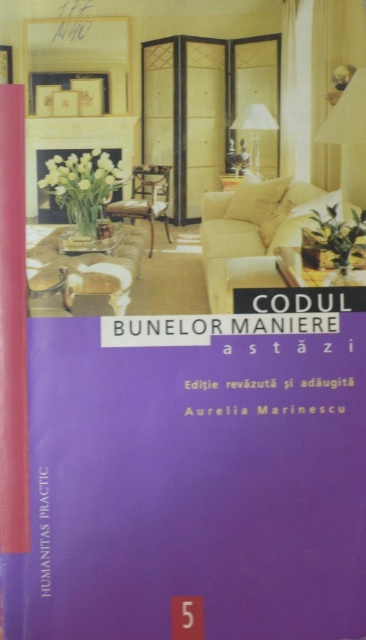
Question: Which point is closer to the camera?

Choices:
 (A) clear glass table at center
 (B) purple matte book at center
 (C) matte white lampshade at upper center

Answer: (B)

Question: Which object is the closest to the wooden table at center?

Choices:
 (A) purple matte book at center
 (B) matte white lampshade at upper center
 (C) clear glass table at center

Answer: (B)

Question: Is the position of purple matte book at center more distant than that of matte white lampshade at upper center?

Choices:
 (A) yes
 (B) no

Answer: (B)

Question: Can you confirm if purple matte book at center is positioned below matte white lampshade at upper center?

Choices:
 (A) no
 (B) yes

Answer: (B)

Question: Which point appears farthest from the camera in this image?

Choices:
 (A) (297, 252)
 (B) (258, 125)

Answer: (A)

Question: Can you confirm if purple matte book at center is smaller than clear glass table at center?

Choices:
 (A) no
 (B) yes

Answer: (A)